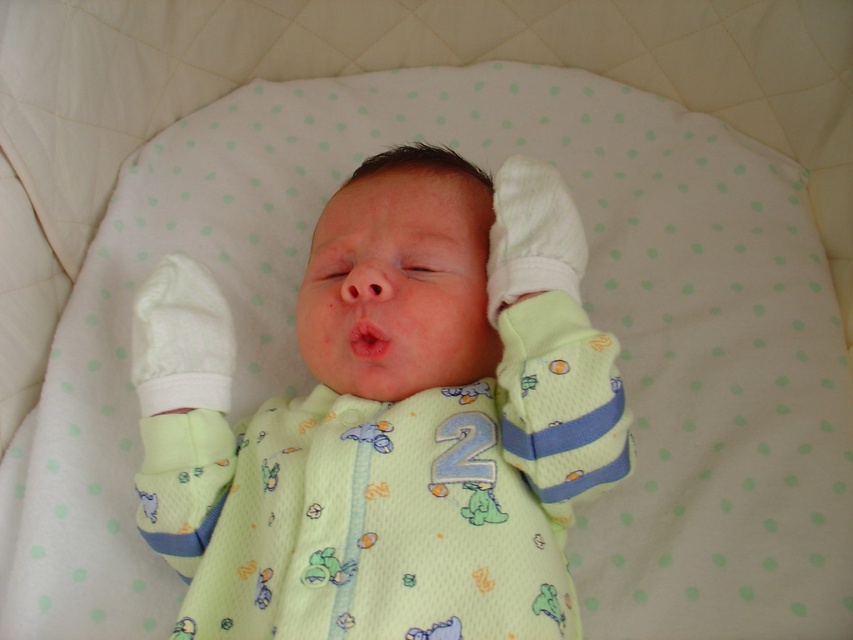
Can you confirm if light green jersey at center is positioned below pink smooth flesh at center?

Indeed, light green jersey at center is positioned under pink smooth flesh at center.

Is light green jersey at center to the right of pink smooth flesh at center from the viewer's perspective?

Indeed, light green jersey at center is positioned on the right side of pink smooth flesh at center.

What do you see at coordinates (389, 419) in the screenshot? This screenshot has width=853, height=640. I see `light green jersey at center` at bounding box center [389, 419].

This screenshot has height=640, width=853. Identify the location of light green jersey at center. (389, 419).